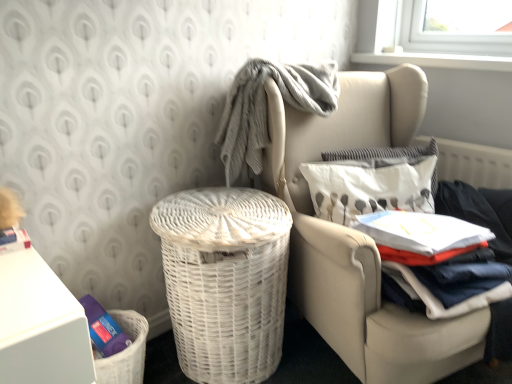
Question: Considering the relative sizes of white cotton shirt at right and white wicker basket at center-left in the image provided, is white cotton shirt at right shorter than white wicker basket at center-left?

Choices:
 (A) yes
 (B) no

Answer: (A)

Question: Is white cotton shirt at right located outside white wicker basket at center-left?

Choices:
 (A) yes
 (B) no

Answer: (A)

Question: Is white cotton shirt at right oriented away from white wicker basket at center-left?

Choices:
 (A) no
 (B) yes

Answer: (A)

Question: From the image's perspective, is white cotton shirt at right below white wicker basket at center-left?

Choices:
 (A) yes
 (B) no

Answer: (B)

Question: Does white cotton shirt at right lie in front of white wicker basket at center-left?

Choices:
 (A) yes
 (B) no

Answer: (A)

Question: Relative to white wicker chair at center, is white textured pillow at upper right, which is counted as the 1th pillow, starting from the back, in front or behind?

Choices:
 (A) behind
 (B) front

Answer: (A)

Question: Is white textured pillow at upper right, placed as the 2th pillow when sorted from front to back, situated inside white wicker chair at center or outside?

Choices:
 (A) inside
 (B) outside

Answer: (A)

Question: Looking at the image, does white textured pillow at upper right, placed as the 2th pillow when sorted from front to back, seem bigger or smaller compared to white wicker chair at center?

Choices:
 (A) big
 (B) small

Answer: (B)

Question: Is point (330, 158) positioned closer to the camera than point (395, 322)?

Choices:
 (A) closer
 (B) farther

Answer: (B)

Question: Visually, is white cotton shirt at right positioned to the left or to the right of gray textured blanket at upper center?

Choices:
 (A) right
 (B) left

Answer: (A)

Question: From a real-world perspective, is white cotton shirt at right above or below gray textured blanket at upper center?

Choices:
 (A) above
 (B) below

Answer: (B)

Question: Is white cotton shirt at right in front of or behind gray textured blanket at upper center in the image?

Choices:
 (A) front
 (B) behind

Answer: (A)

Question: In terms of height, does white cotton shirt at right look taller or shorter compared to gray textured blanket at upper center?

Choices:
 (A) short
 (B) tall

Answer: (A)

Question: Does point (365, 150) appear closer or farther from the camera than point (280, 311)?

Choices:
 (A) farther
 (B) closer

Answer: (A)

Question: In terms of width, does white textured pillow at upper right, placed as the 2th pillow when sorted from front to back, look wider or thinner when compared to white wicker basket at center-left?

Choices:
 (A) thin
 (B) wide

Answer: (A)